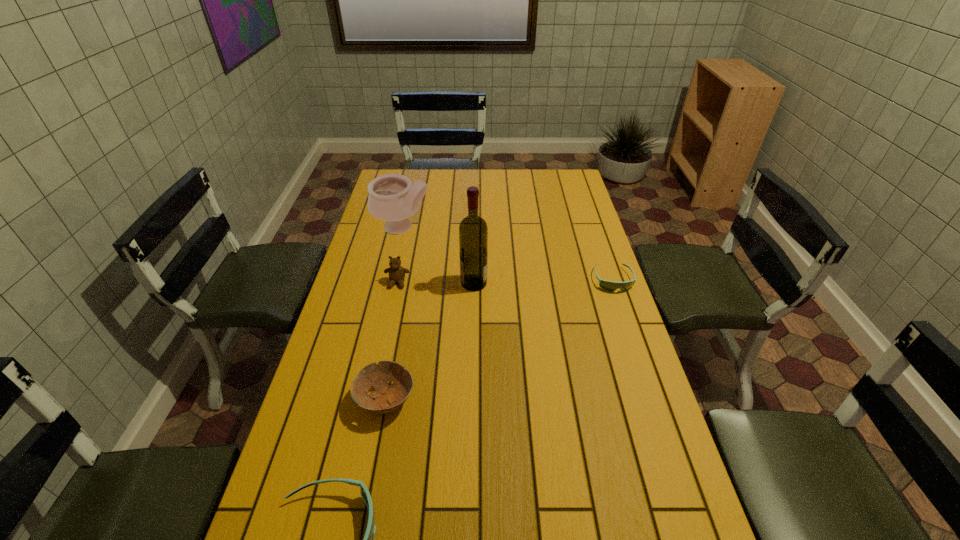
At what (x,y) coordinates should I click in order to perform the action: click on vacant space located on the front and back of the fifth object from left to right. Please return your answer as a coordinate pair (x, y). Looking at the image, I should click on click(x=558, y=283).

Find the location of a particular element. This screenshot has width=960, height=540. free spot located on the right of the second tallest object is located at coordinates (483, 227).

Where is `free spot located on the back of the second nearest object`? The width and height of the screenshot is (960, 540). free spot located on the back of the second nearest object is located at coordinates (396, 342).

Find the location of `teddy bear present at the left edge`. teddy bear present at the left edge is located at coordinates (396, 272).

What are the coordinates of `pottery that is at the left edge` in the screenshot? It's located at (392, 198).

Locate an element on the screen. bowl present at the left edge is located at coordinates (387, 398).

Locate an element on the screen. object at the right edge is located at coordinates tap(611, 286).

The image size is (960, 540). I want to click on free spot at the far edge of the desktop, so click(x=507, y=185).

The image size is (960, 540). What are the coordinates of `vacant area at the left edge of the desktop` in the screenshot? It's located at (350, 276).

In the image, there is a desktop. Identify the location of vacant region at the right edge. 562,240.